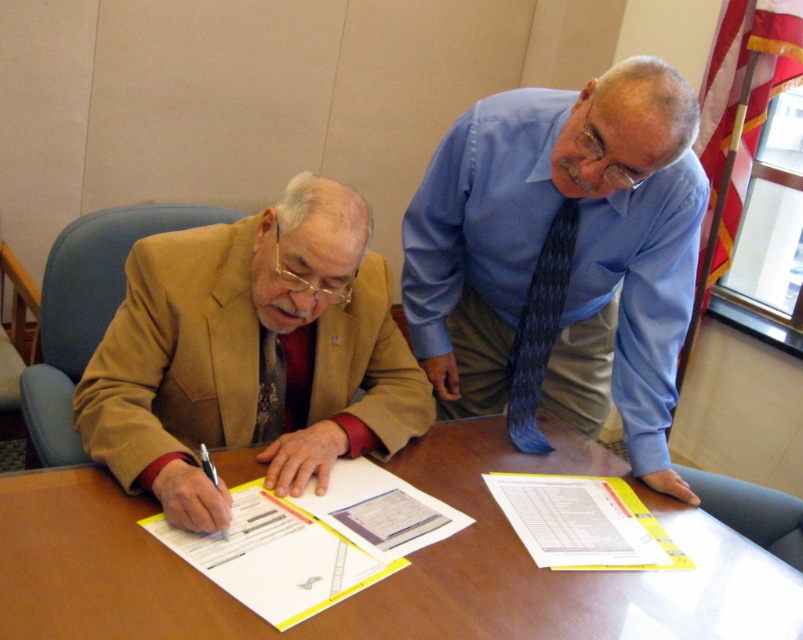
Question: Which point appears closest to the camera in this image?

Choices:
 (A) (157, 515)
 (B) (378, 400)
 (C) (636, 548)

Answer: (A)

Question: Which point is farther to the camera?

Choices:
 (A) yellow paper at center
 (B) blue textured shirt at upper right
 (C) matte brown suit at left

Answer: (A)

Question: Does white paper at center have a greater width compared to blue textured tie at upper right?

Choices:
 (A) yes
 (B) no

Answer: (A)

Question: Does blue textured shirt at upper right have a larger size compared to white paper at center?

Choices:
 (A) yes
 (B) no

Answer: (A)

Question: Estimate the real-world distances between objects in this image. Which object is closer to the yellow paper at center?

Choices:
 (A) blue textured shirt at upper right
 (B) brown wooden table at center
 (C) dark red textured tie at left
 (D) white paper at center

Answer: (B)

Question: Does blue textured shirt at upper right come in front of matte brown suit at left?

Choices:
 (A) yes
 (B) no

Answer: (B)